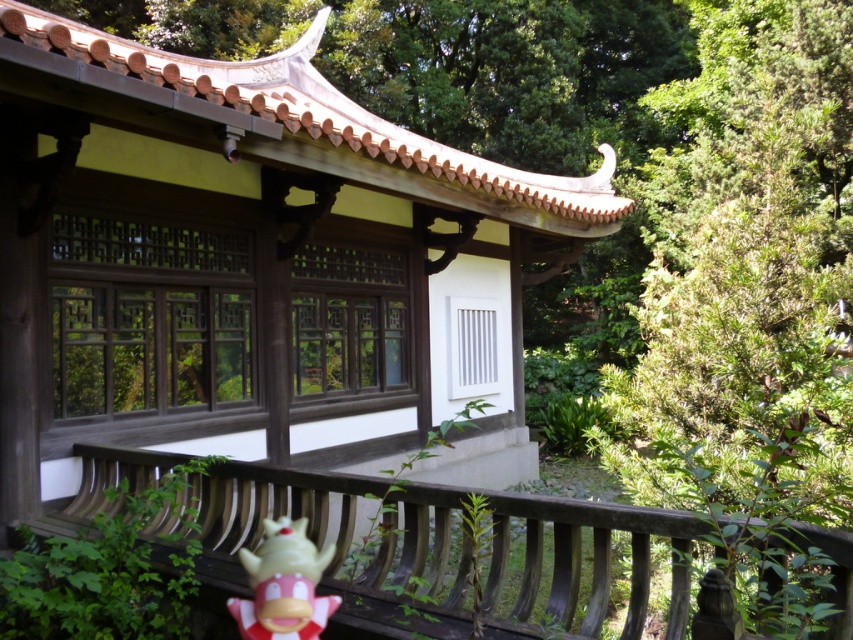
You are standing in front of the pavilion and see two points marked on the railing. The first point is at coordinates point [584,554] and the second is at point [289,548]. Which point is closer to you?

Point [289,548] is closer to you because it is less further to the camera than point [584,554].